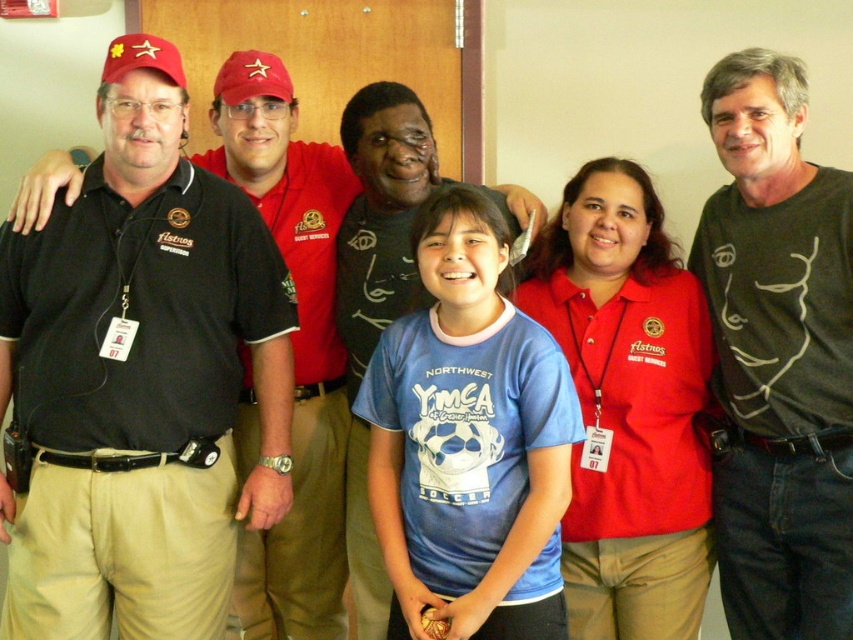
Can you confirm if blue cotton shirt at center is thinner than black shirt at left?

Indeed, blue cotton shirt at center has a lesser width compared to black shirt at left.

Does point (515, 557) come behind point (322, 625)?

No, it is not.

Is point (373, 401) positioned before point (323, 552)?

Yes, point (373, 401) is in front of point (323, 552).

Identify the location of blue cotton shirt at center. (x=469, y=442).

Image resolution: width=853 pixels, height=640 pixels. What do you see at coordinates (628, 406) in the screenshot?
I see `red matte shirt at center` at bounding box center [628, 406].

Who is more forward, [593,288] or [331,545]?

Positioned in front is point [593,288].

At what (x,y) coordinates should I click in order to perform the action: click on red matte shirt at center. Please return your answer as a coordinate pair (x, y). The height and width of the screenshot is (640, 853). Looking at the image, I should click on (628, 406).

Looking at this image, does black matte shirt at right appear on the left side of blue cotton shirt at center?

No, black matte shirt at right is not to the left of blue cotton shirt at center.

Image resolution: width=853 pixels, height=640 pixels. Describe the element at coordinates (778, 355) in the screenshot. I see `black matte shirt at right` at that location.

Find the location of `black matte shirt at right`. black matte shirt at right is located at coordinates (778, 355).